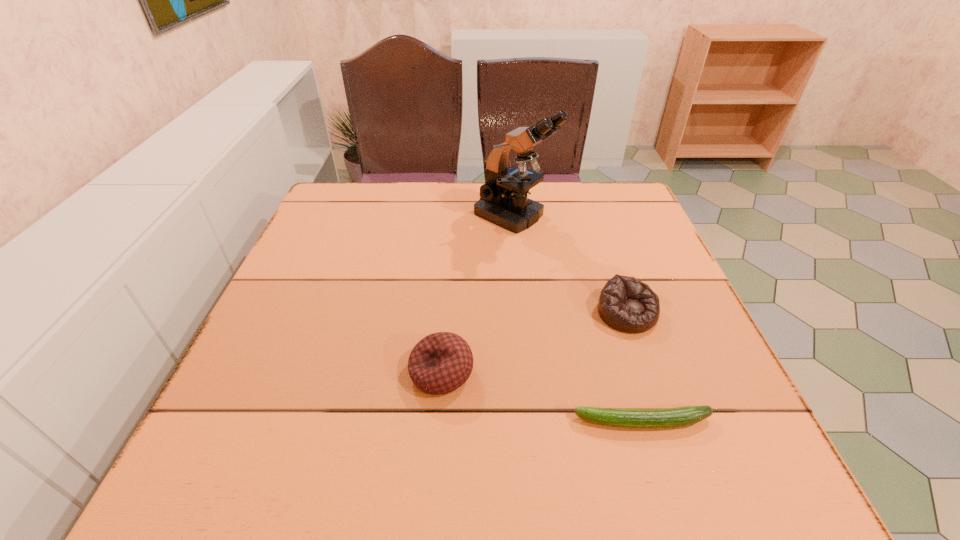
This screenshot has height=540, width=960. In order to click on the farthest object in this screenshot , I will do `click(503, 201)`.

Identify the location of microscope. Image resolution: width=960 pixels, height=540 pixels. (503, 201).

Locate an element on the screen. the second tallest object is located at coordinates (441, 362).

Where is `the left beanbag`? The height and width of the screenshot is (540, 960). the left beanbag is located at coordinates (441, 362).

Locate an element on the screen. Image resolution: width=960 pixels, height=540 pixels. the right beanbag is located at coordinates (626, 304).

You are a GUI agent. You are given a task and a screenshot of the screen. Output one action in this format:
    pyautogui.click(x=<x>, y=<y>)
    Task: Click on the shorter beanbag
    The width and height of the screenshot is (960, 540).
    Given the screenshot: What is the action you would take?
    pyautogui.click(x=626, y=304)

The width and height of the screenshot is (960, 540). I want to click on the nearest object, so click(x=681, y=416).

Where is `the shortest object`? The height and width of the screenshot is (540, 960). the shortest object is located at coordinates (681, 416).

Locate an element on the screen. This screenshot has height=540, width=960. vacant point located on the front of the farthest object is located at coordinates (521, 291).

Where is `vacant area situated 0.340m on the right of the left beanbag`? The width and height of the screenshot is (960, 540). vacant area situated 0.340m on the right of the left beanbag is located at coordinates (660, 372).